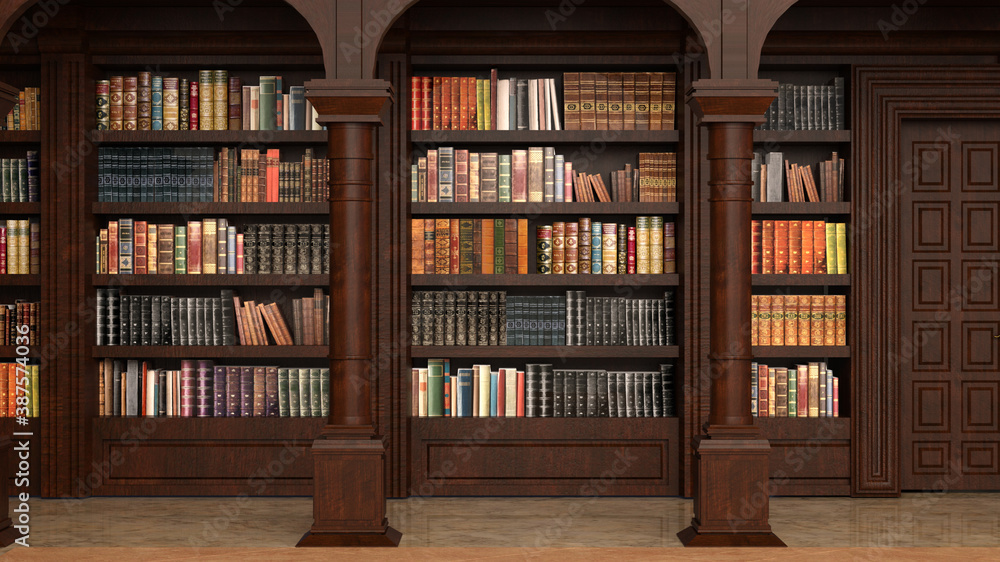
Locate an element on the screen. The width and height of the screenshot is (1000, 562). gold cover books is located at coordinates (842, 333), (798, 329), (763, 336), (778, 328), (820, 333).